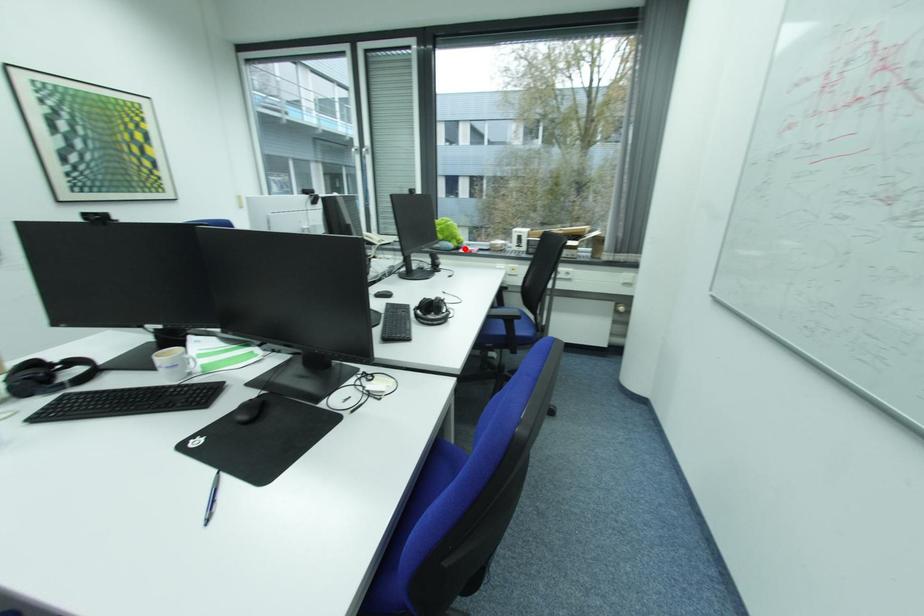
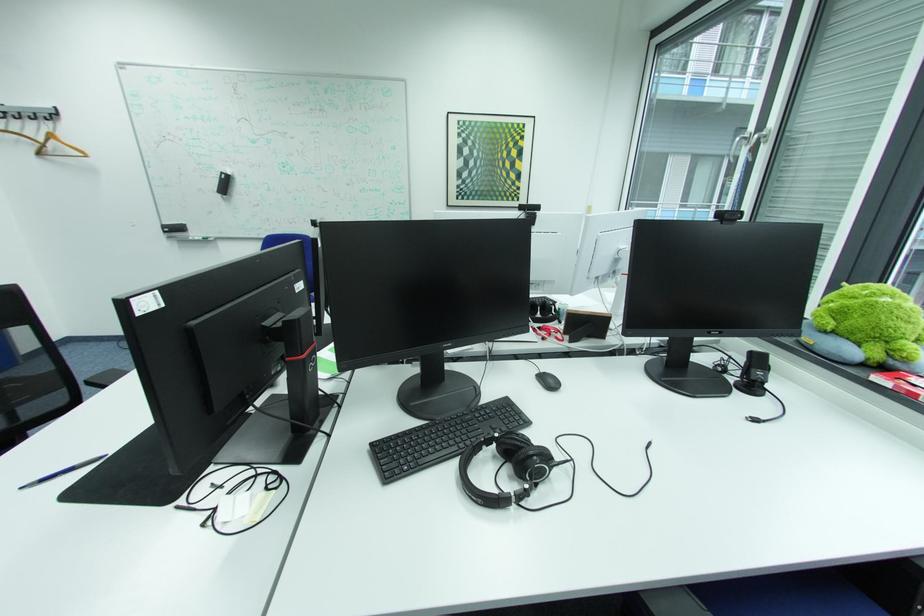
Locate, in the second image, the point that corresponds to the highlighted location in the first image.

(882, 365)